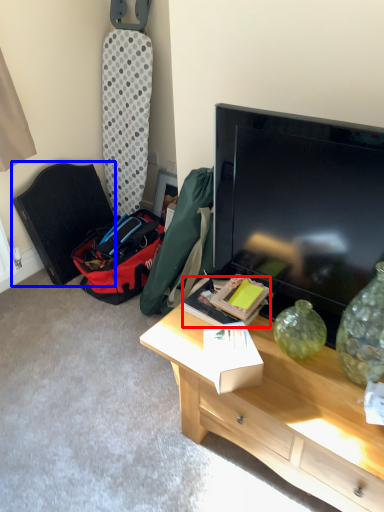
Question: Which object appears farthest to the camera in this image, box (highlighted by a red box) or folding chair (highlighted by a blue box)?

Choices:
 (A) box
 (B) folding chair

Answer: (B)